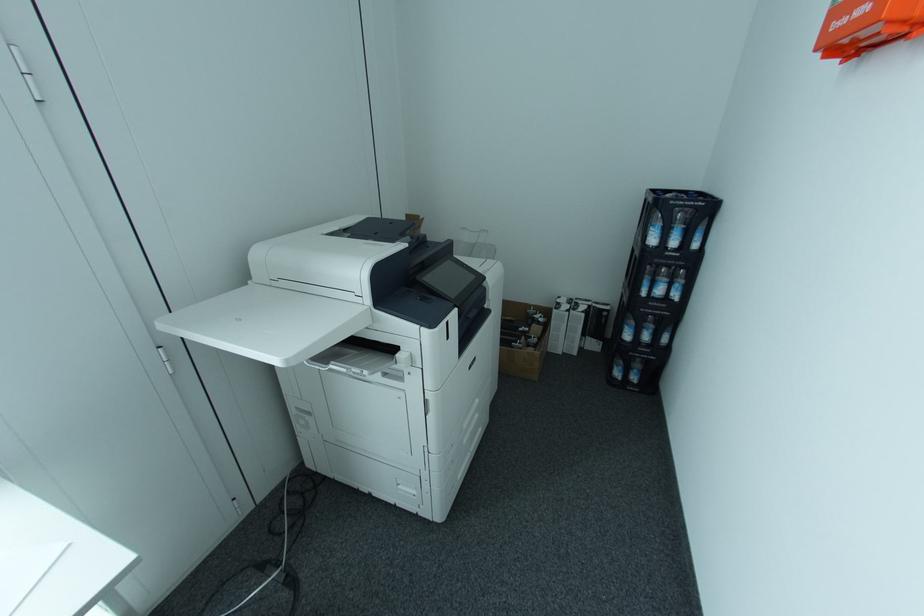
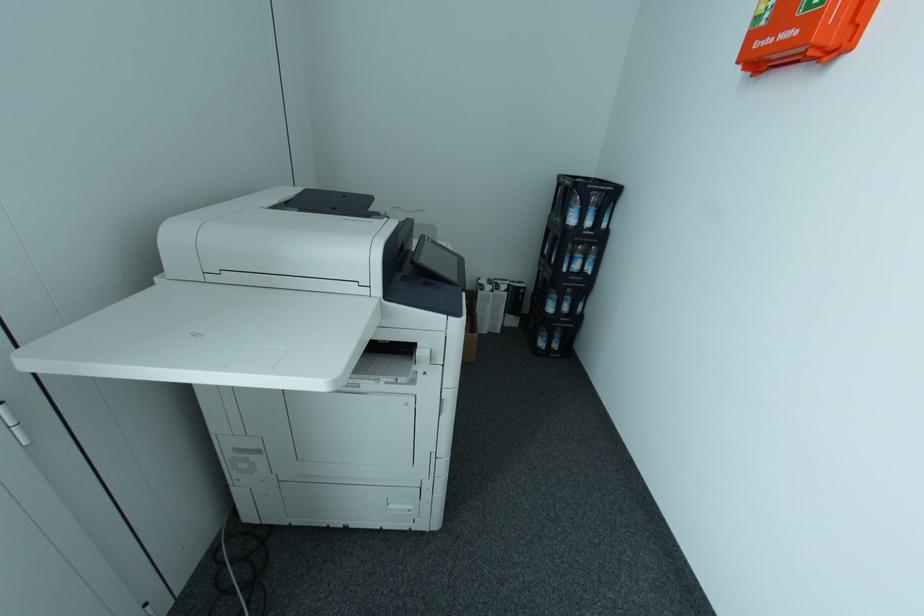
Question: The camera is either moving clockwise (left) or counter-clockwise (right) around the object. The first image is from the beginning of the video and the second image is from the end. Is the camera moving left or right when shooting the video?

Choices:
 (A) Left
 (B) Right

Answer: (A)